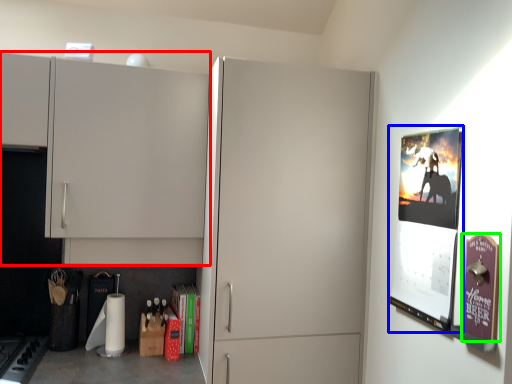
Question: Estimate the real-world distances between objects in this image. Which object is farther from cupboard (highlighted by a red box), poster page (highlighted by a blue box) or poster page (highlighted by a green box)?

Choices:
 (A) poster page
 (B) poster page

Answer: (B)